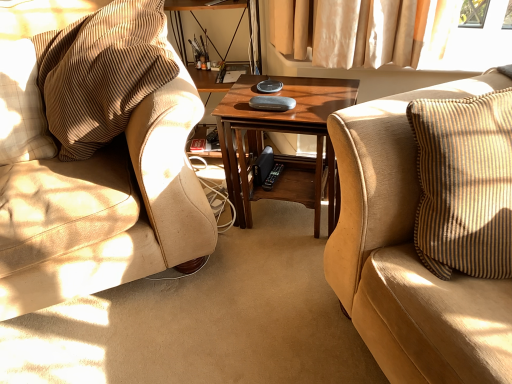
Question: Is beige textured pillow at left at the back of wooden coffee table at center?

Choices:
 (A) yes
 (B) no

Answer: (B)

Question: Is wooden coffee table at center far from beige textured pillow at left?

Choices:
 (A) no
 (B) yes

Answer: (A)

Question: Does wooden coffee table at center have a lesser height compared to beige textured pillow at left?

Choices:
 (A) yes
 (B) no

Answer: (B)

Question: Can you confirm if wooden coffee table at center is positioned to the right of beige textured pillow at left?

Choices:
 (A) yes
 (B) no

Answer: (A)

Question: Is wooden coffee table at center smaller than beige textured pillow at left?

Choices:
 (A) yes
 (B) no

Answer: (B)

Question: Can you confirm if wooden coffee table at center is taller than beige textured pillow at left?

Choices:
 (A) no
 (B) yes

Answer: (B)

Question: Considering the relative sizes of brown corduroy chair at left and beige textured pillow at left in the image provided, is brown corduroy chair at left wider than beige textured pillow at left?

Choices:
 (A) yes
 (B) no

Answer: (A)

Question: Is brown corduroy chair at left beside beige textured pillow at left?

Choices:
 (A) no
 (B) yes

Answer: (A)

Question: Can you confirm if brown corduroy chair at left is taller than beige textured pillow at left?

Choices:
 (A) yes
 (B) no

Answer: (A)

Question: Considering the relative sizes of brown corduroy chair at left and beige textured pillow at left in the image provided, is brown corduroy chair at left thinner than beige textured pillow at left?

Choices:
 (A) yes
 (B) no

Answer: (B)

Question: Can you confirm if brown corduroy chair at left is bigger than beige textured pillow at left?

Choices:
 (A) yes
 (B) no

Answer: (A)

Question: Is the depth of brown corduroy chair at left greater than that of beige textured pillow at left?

Choices:
 (A) no
 (B) yes

Answer: (A)

Question: Is beige textured pillow at left taller than brown corduroy chair at left?

Choices:
 (A) yes
 (B) no

Answer: (B)